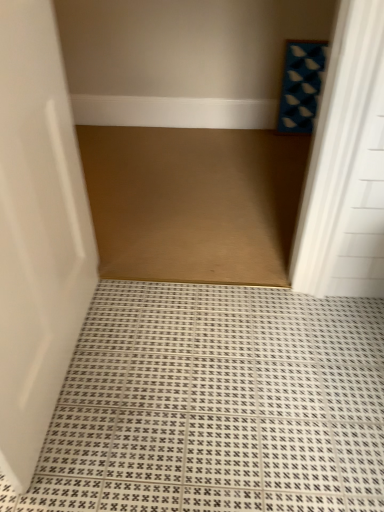
This screenshot has height=512, width=384. Describe the element at coordinates (174, 112) in the screenshot. I see `white smooth baseboard at upper center` at that location.

I want to click on white smooth baseboard at upper center, so 174,112.

You are a GUI agent. You are given a task and a screenshot of the screen. Output one action in this format:
    pyautogui.click(x=<x>, y=<y>)
    Task: Click on the white smooth baseboard at upper center
    Image resolution: width=384 pixels, height=512 pixels.
    Given the screenshot: What is the action you would take?
    pyautogui.click(x=174, y=112)